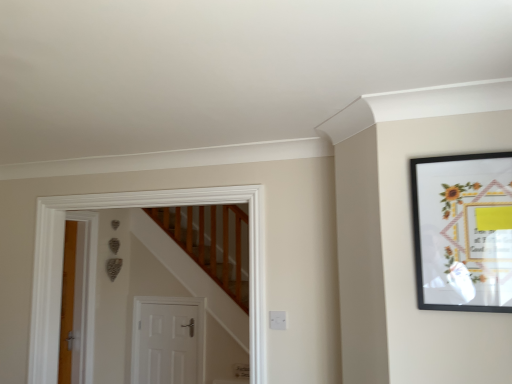
What do you see at coordinates (168, 344) in the screenshot?
I see `white matte door at center` at bounding box center [168, 344].

This screenshot has height=384, width=512. Identify the location of white matte door at center. (168, 344).

You are a GUI agent. You are given a task and a screenshot of the screen. Output one action in this format:
    pyautogui.click(x=<x>, y=<y>)
    Task: Click on the black matte picture frame at upper right
    Image resolution: width=512 pixels, height=384 pixels.
    Given the screenshot: What is the action you would take?
    pyautogui.click(x=463, y=231)

The image size is (512, 384). Describe the element at coordinates (463, 231) in the screenshot. I see `black matte picture frame at upper right` at that location.

Find the location of a particular element. This screenshot has width=512, height=384. white matte door at center is located at coordinates (168, 344).

Does white matte door at center appear on the left side of black matte picture frame at upper right?

Yes.

Which object is further away from the camera taking this photo, white matte door at center or black matte picture frame at upper right?

white matte door at center is behind.

Does point (163, 359) lie behind point (448, 237)?

Yes, it is behind point (448, 237).

From the picture: From the image's perspective, is white matte door at center beneath black matte picture frame at upper right?

Correct, white matte door at center appears lower than black matte picture frame at upper right in the image.

From a real-world perspective, is white matte door at center positioned under black matte picture frame at upper right based on gravity?

Yes.

Which of these two, white matte door at center or black matte picture frame at upper right, is thinner?

black matte picture frame at upper right.

Which of these two, white matte door at center or black matte picture frame at upper right, stands shorter?

Standing shorter between the two is black matte picture frame at upper right.

Between white matte door at center and black matte picture frame at upper right, which one has smaller size?

black matte picture frame at upper right is smaller.

Is white matte door at center outside of black matte picture frame at upper right?

white matte door at center lies outside black matte picture frame at upper right's area.

Is white matte door at center far away from black matte picture frame at upper right?

white matte door at center is positioned a significant distance from black matte picture frame at upper right.

Is white matte door at center facing away from black matte picture frame at upper right?

No, white matte door at center is not facing away from black matte picture frame at upper right.

How much distance is there between white matte door at center and black matte picture frame at upper right?

white matte door at center and black matte picture frame at upper right are 3.00 meters apart.

Where is `door located underneath the black matte picture frame at upper right (from a real-world perspective)`? The width and height of the screenshot is (512, 384). door located underneath the black matte picture frame at upper right (from a real-world perspective) is located at coordinates (168, 344).

Is black matte picture frame at upper right to the left or to the right of white matte door at center in the image?

From the image, it's evident that black matte picture frame at upper right is to the right of white matte door at center.

Relative to white matte door at center, is black matte picture frame at upper right in front or behind?

Visually, black matte picture frame at upper right is located in front of white matte door at center.

Considering the positions of point (423, 159) and point (191, 307), is point (423, 159) closer or farther from the camera than point (191, 307)?

Point (423, 159).

From the image's perspective, is black matte picture frame at upper right located beneath white matte door at center?

Actually, black matte picture frame at upper right appears above white matte door at center in the image.

From a real-world perspective, is black matte picture frame at upper right physically located above or below white matte door at center?

Clearly, from a real-world perspective, black matte picture frame at upper right is above white matte door at center.

Is black matte picture frame at upper right thinner than white matte door at center?

Yes, black matte picture frame at upper right is thinner than white matte door at center.

Who is shorter, black matte picture frame at upper right or white matte door at center?

black matte picture frame at upper right is shorter.

Does black matte picture frame at upper right have a larger size compared to white matte door at center?

No, black matte picture frame at upper right is not bigger than white matte door at center.

Is black matte picture frame at upper right outside of white matte door at center?

Yes, black matte picture frame at upper right is not within white matte door at center.

Is black matte picture frame at upper right directly adjacent to white matte door at center?

No, black matte picture frame at upper right is not in contact with white matte door at center.

Is black matte picture frame at upper right aimed at white matte door at center?

No, black matte picture frame at upper right is not aimed at white matte door at center.

I want to click on picture frame to the right of white matte door at center, so pos(463,231).

At what (x,y) coordinates should I click in order to perform the action: click on picture frame that appears above the white matte door at center (from a real-world perspective). Please return your answer as a coordinate pair (x, y). Looking at the image, I should click on (463, 231).

Where is `picture frame lying on the right of white matte door at center`? The height and width of the screenshot is (384, 512). picture frame lying on the right of white matte door at center is located at coordinates (463, 231).